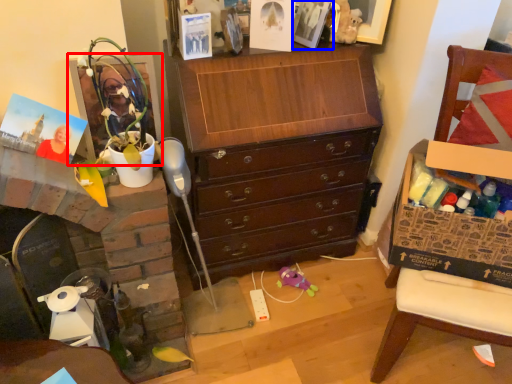
Question: Which object appears farthest to the camera in this image, picture frame (highlighted by a red box) or picture frame (highlighted by a blue box)?

Choices:
 (A) picture frame
 (B) picture frame

Answer: (B)